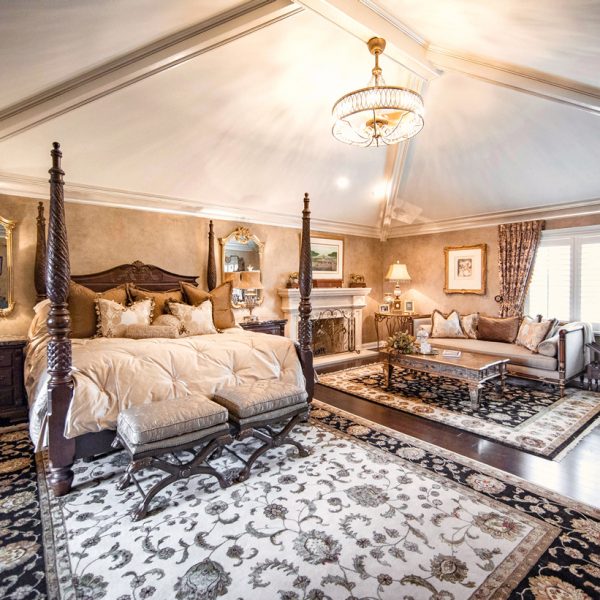
This screenshot has width=600, height=600. Find the location of `light`. light is located at coordinates (399, 272).